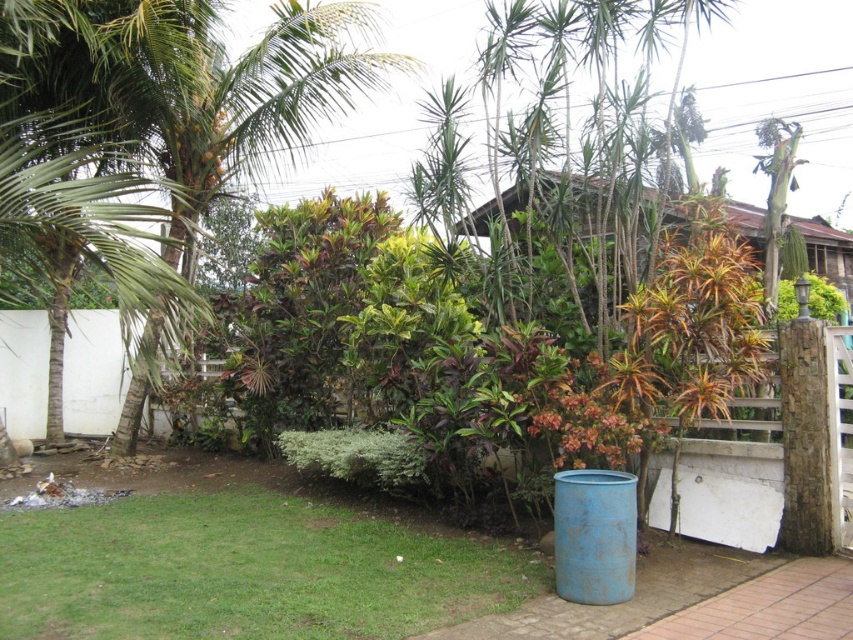
Question: In this image, where is green leafy palm tree at left located relative to brown wooden hut at upper center?

Choices:
 (A) right
 (B) left

Answer: (B)

Question: From the image, what is the correct spatial relationship of green leafy palm tree at left in relation to brown wooden hut at upper center?

Choices:
 (A) right
 (B) left

Answer: (B)

Question: Where is green leafy palm tree at left located in relation to green grass at lower left in the image?

Choices:
 (A) right
 (B) left

Answer: (B)

Question: Which point is farther to the camera?

Choices:
 (A) green grass at lower left
 (B) green leafy palm tree at left
 (C) brown wooden hut at upper center

Answer: (B)

Question: Which of the following is the farthest from the observer?

Choices:
 (A) green leafy palm tree at left
 (B) green grass at lower left
 (C) brown wooden hut at upper center

Answer: (A)

Question: Estimate the real-world distances between objects in this image. Which object is farther from the green grass at lower left?

Choices:
 (A) brown wooden hut at upper center
 (B) green leafy palm tree at left

Answer: (B)